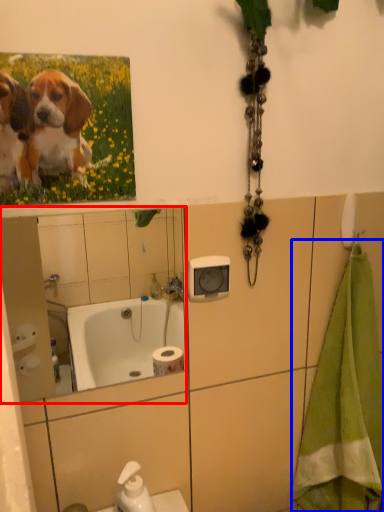
Question: Which object is further to the camera taking this photo, mirror (highlighted by a red box) or bath towel (highlighted by a blue box)?

Choices:
 (A) mirror
 (B) bath towel

Answer: (B)